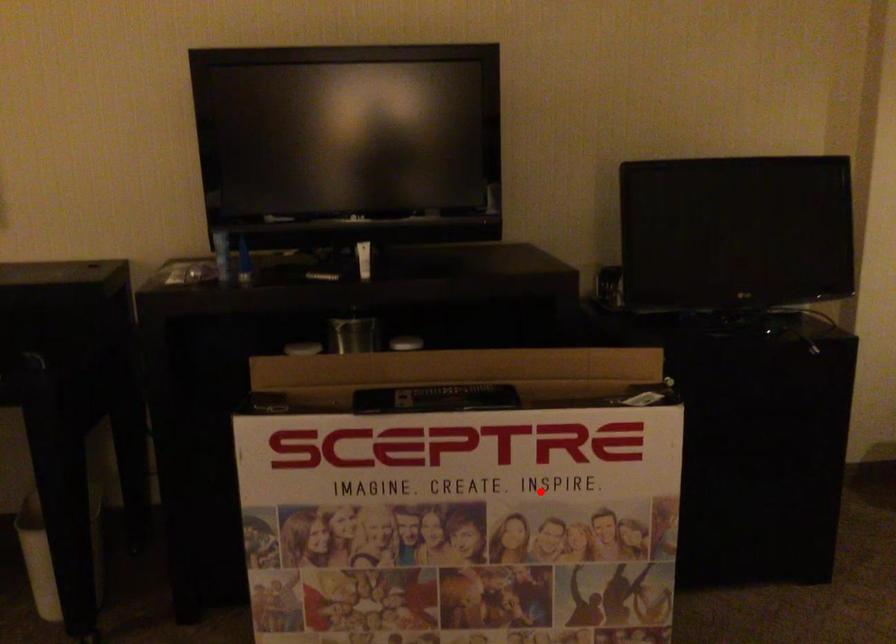
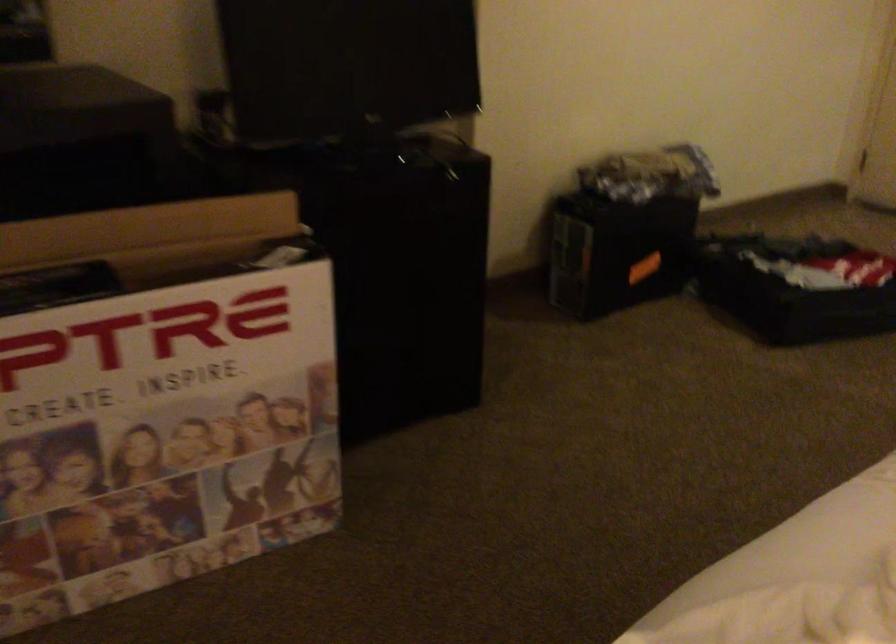
The point at the highlighted location is marked in the first image. Where is the corresponding point in the second image?

(171, 393)